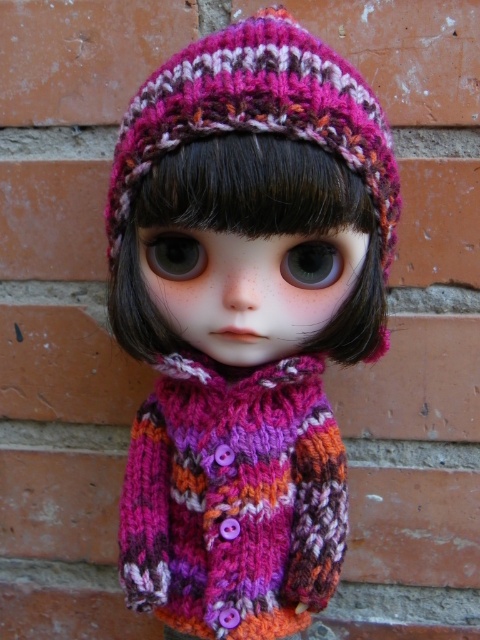
Question: Among these objects, which one is nearest to the camera?

Choices:
 (A) knitted pink hat at upper center
 (B) knitted wool scarf at center

Answer: (A)

Question: Can you confirm if knitted wool scarf at center is positioned below knitted pink hat at upper center?

Choices:
 (A) yes
 (B) no

Answer: (A)

Question: Which point is closer to the camera taking this photo?

Choices:
 (A) (197, 605)
 (B) (285, 481)
 (C) (363, 157)

Answer: (C)

Question: Is knitted woolen sweater at center in front of knitted pink hat at upper center?

Choices:
 (A) yes
 (B) no

Answer: (A)

Question: Based on their relative distances, which object is nearer to the knitted wool scarf at center?

Choices:
 (A) knitted woolen sweater at center
 (B) knitted pink hat at upper center

Answer: (A)

Question: Does knitted woolen sweater at center have a larger size compared to knitted wool scarf at center?

Choices:
 (A) no
 (B) yes

Answer: (B)